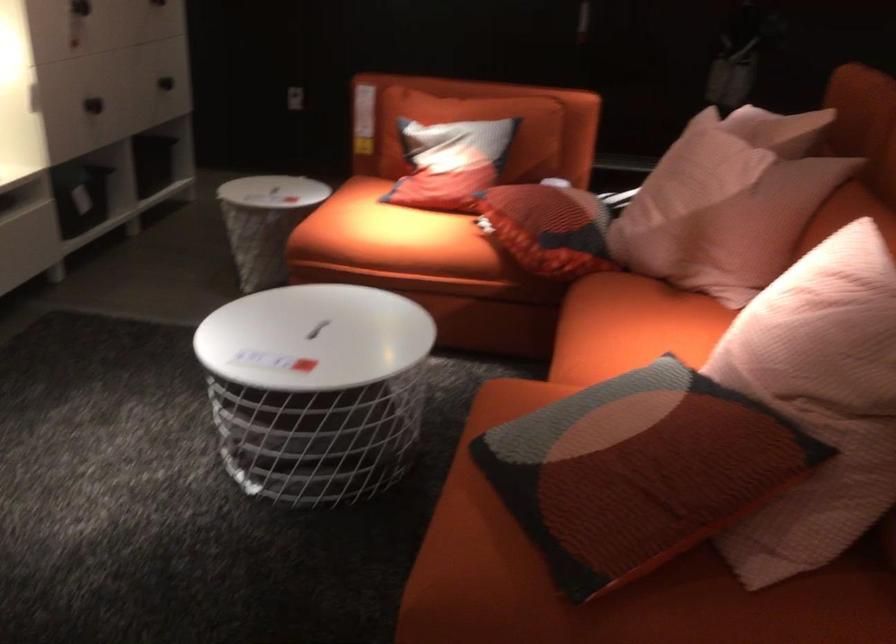
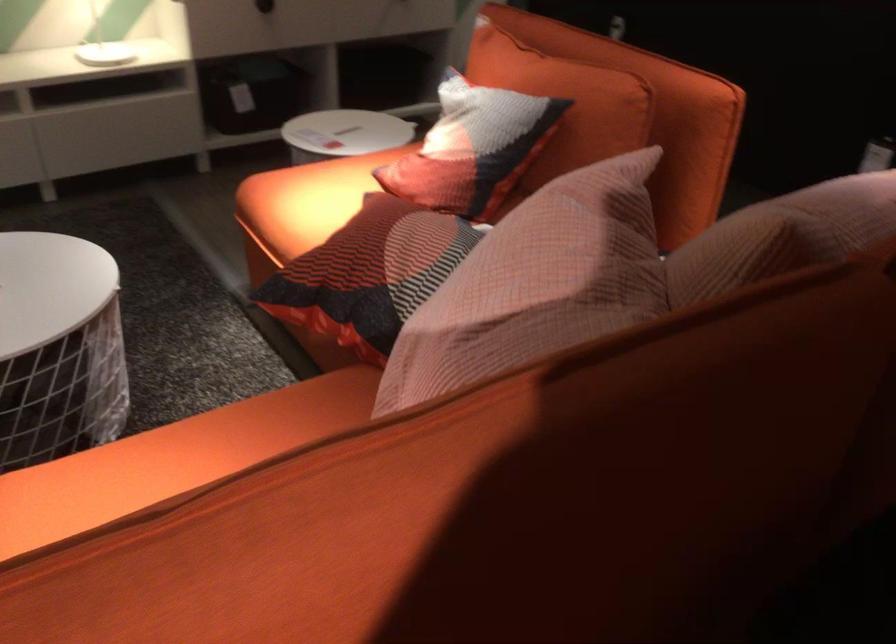
Find the pixel in the second image that matches point (574, 218) in the first image.

(369, 274)